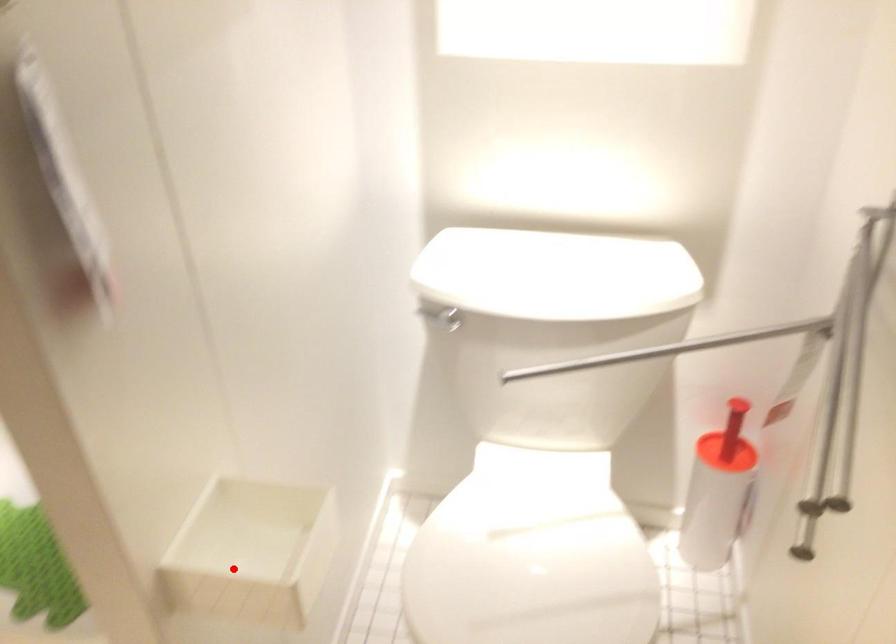
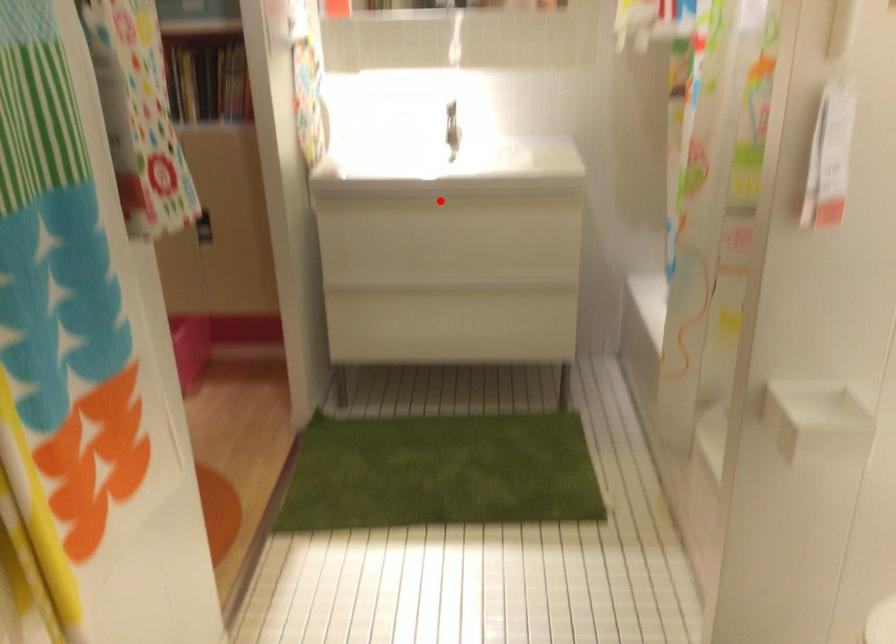
I am providing you with two images of the same scene from different viewpoints. A red point is marked on the first image and another point is marked on the second image. Do the highlighted points in image1 and image2 indicate the same real-world spot?

No